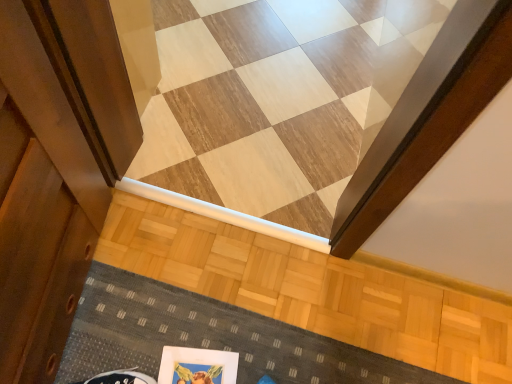
Question: Is matte white picture frame at lower center in front of textured gray doormat at lower center?

Choices:
 (A) no
 (B) yes

Answer: (B)

Question: Is matte white picture frame at lower center positioned beyond the bounds of textured gray doormat at lower center?

Choices:
 (A) no
 (B) yes

Answer: (A)

Question: From the image's perspective, is matte white picture frame at lower center above textured gray doormat at lower center?

Choices:
 (A) yes
 (B) no

Answer: (B)

Question: From the image's perspective, is matte white picture frame at lower center beneath textured gray doormat at lower center?

Choices:
 (A) yes
 (B) no

Answer: (A)

Question: Considering the relative sizes of matte white picture frame at lower center and textured gray doormat at lower center in the image provided, is matte white picture frame at lower center bigger than textured gray doormat at lower center?

Choices:
 (A) no
 (B) yes

Answer: (A)

Question: Is matte white picture frame at lower center facing away from textured gray doormat at lower center?

Choices:
 (A) no
 (B) yes

Answer: (B)

Question: Can we say textured gray doormat at lower center lies outside wooden floor at center?

Choices:
 (A) no
 (B) yes

Answer: (B)

Question: Does textured gray doormat at lower center touch wooden floor at center?

Choices:
 (A) yes
 (B) no

Answer: (B)

Question: Does textured gray doormat at lower center lie behind wooden floor at center?

Choices:
 (A) yes
 (B) no

Answer: (B)

Question: Can you confirm if textured gray doormat at lower center is thinner than wooden floor at center?

Choices:
 (A) no
 (B) yes

Answer: (B)

Question: Can you confirm if textured gray doormat at lower center is shorter than wooden floor at center?

Choices:
 (A) yes
 (B) no

Answer: (B)

Question: Can you confirm if textured gray doormat at lower center is wider than wooden floor at center?

Choices:
 (A) yes
 (B) no

Answer: (B)

Question: Is wooden floor at center at the right side of textured gray doormat at lower center?

Choices:
 (A) yes
 (B) no

Answer: (B)